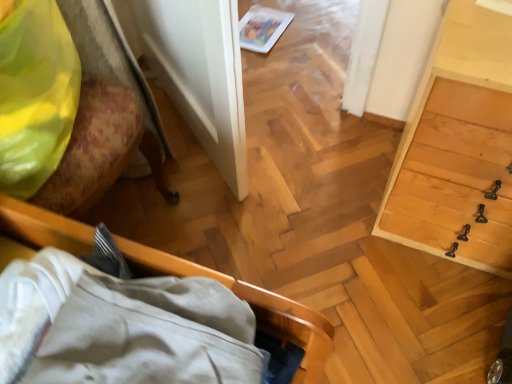
Find the location of a particular element. free spot to the right of wooden chair at left, positioned as the second furniture in right-to-left order is located at coordinates (229, 203).